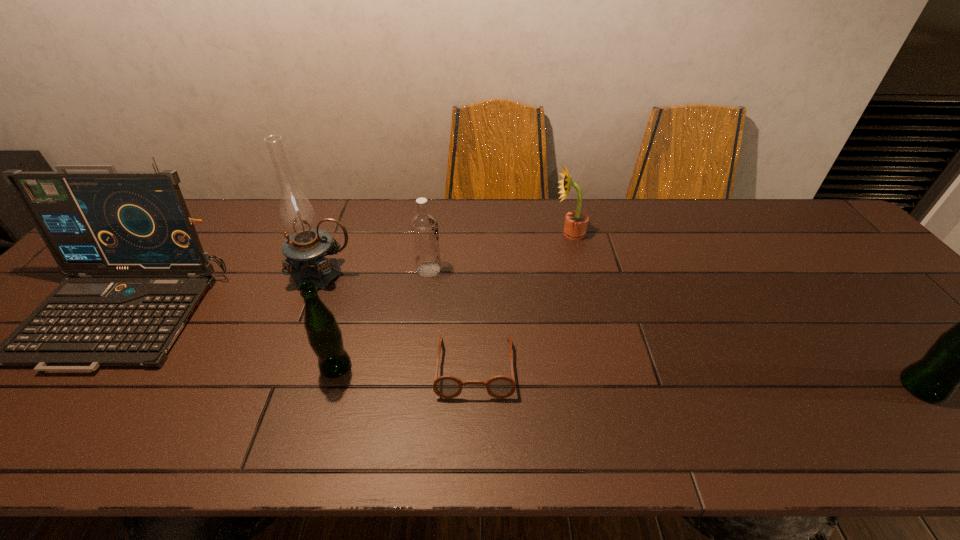
In the image, there is a desktop. Where is `free space at the far edge`? free space at the far edge is located at coordinates (327, 211).

I want to click on vacant area at the near edge of the desktop, so click(x=99, y=400).

Where is `vacant space at the right edge of the desktop`? The height and width of the screenshot is (540, 960). vacant space at the right edge of the desktop is located at coordinates (911, 313).

Locate an element on the screen. vacant area at the near left corner of the desktop is located at coordinates (6, 380).

In the image, there is a desktop. In order to click on vacant space at the far right corner in this screenshot , I will do `click(790, 201)`.

Identify the location of free space between the taller beer bottle and the fourth object from right to left. The height and width of the screenshot is (540, 960). (675, 328).

At what (x,y) coordinates should I click in order to perform the action: click on free point between the rightmost object and the second object from right to left. Please return your answer as a coordinate pair (x, y). Image resolution: width=960 pixels, height=540 pixels. Looking at the image, I should click on (746, 310).

You are a GUI agent. You are given a task and a screenshot of the screen. Output one action in this format:
    pyautogui.click(x=<x>, y=<y>)
    Task: Click on the vacant area that lies between the right beer bottle and the shorter beer bottle
    
    Given the screenshot: What is the action you would take?
    pyautogui.click(x=629, y=377)

At what (x,y) coordinates should I click in order to perform the action: click on blank region between the shortest object and the right beer bottle. Please return your answer as a coordinate pair (x, y). The width and height of the screenshot is (960, 540). Looking at the image, I should click on point(698,377).

Where is `free area in between the spectacles and the oil lamp`? free area in between the spectacles and the oil lamp is located at coordinates (399, 320).